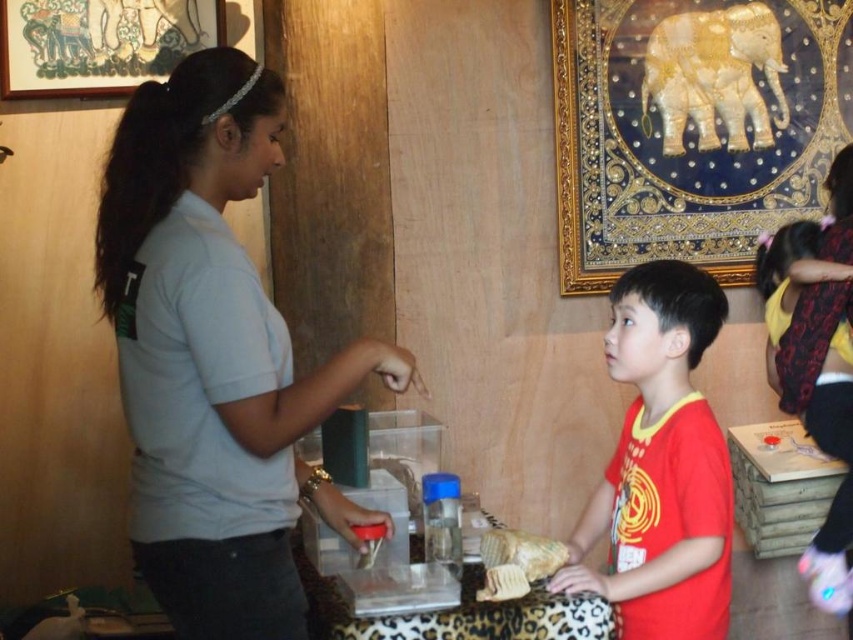
Between point (131, 221) and point (543, 538), which one is positioned in front?

Positioned in front is point (131, 221).

Consider the image. Is light gray shirt at center further to the viewer compared to golden textured bread at lower center?

No, light gray shirt at center is closer to the viewer.

Is point (190, 586) closer to camera compared to point (514, 566)?

That is True.

You are a GUI agent. You are given a task and a screenshot of the screen. Output one action in this format:
    pyautogui.click(x=<x>, y=<y>)
    Task: Click on the light gray shirt at center
    This screenshot has width=853, height=640.
    Given the screenshot: What is the action you would take?
    pyautogui.click(x=213, y=356)

Is light gray shirt at center taller than red matte shirt at center?

Indeed, light gray shirt at center has a greater height compared to red matte shirt at center.

Which is in front, point (165, 396) or point (708, 339)?

Point (165, 396) is in front.

This screenshot has height=640, width=853. Describe the element at coordinates (213, 356) in the screenshot. I see `light gray shirt at center` at that location.

Where is `light gray shirt at center`? light gray shirt at center is located at coordinates (213, 356).

Does red matte shirt at center have a greater width compared to golden textured bread at lower center?

Yes.

Does red matte shirt at center appear on the right side of golden textured bread at lower center?

Indeed, red matte shirt at center is positioned on the right side of golden textured bread at lower center.

Who is more forward, (645, 400) or (526, 563)?

Point (526, 563)

Find the location of a particular element. The width and height of the screenshot is (853, 640). red matte shirt at center is located at coordinates (660, 465).